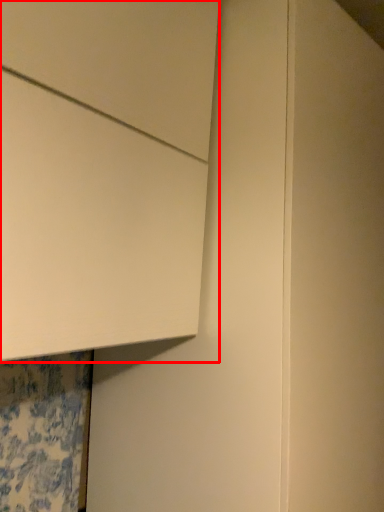
Question: In this image, where is cabinetry (annotated by the red box) located relative to door?

Choices:
 (A) right
 (B) left

Answer: (B)